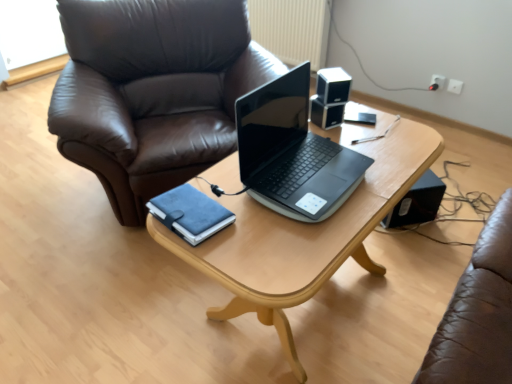
Locate an element on the screen. This screenshot has height=384, width=512. vacant space behind suede blue notebook at center is located at coordinates (219, 179).